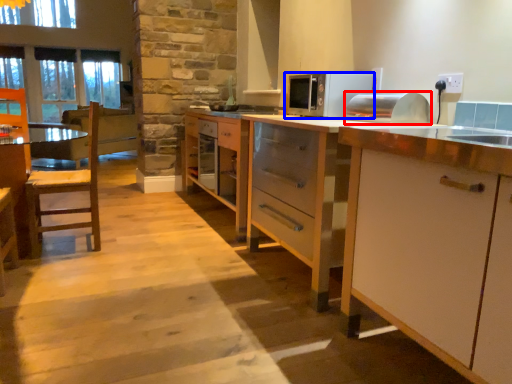
Question: Which of the following is the farthest to the observer, appliance (highlighted by a red box) or microwave oven (highlighted by a blue box)?

Choices:
 (A) appliance
 (B) microwave oven

Answer: (B)